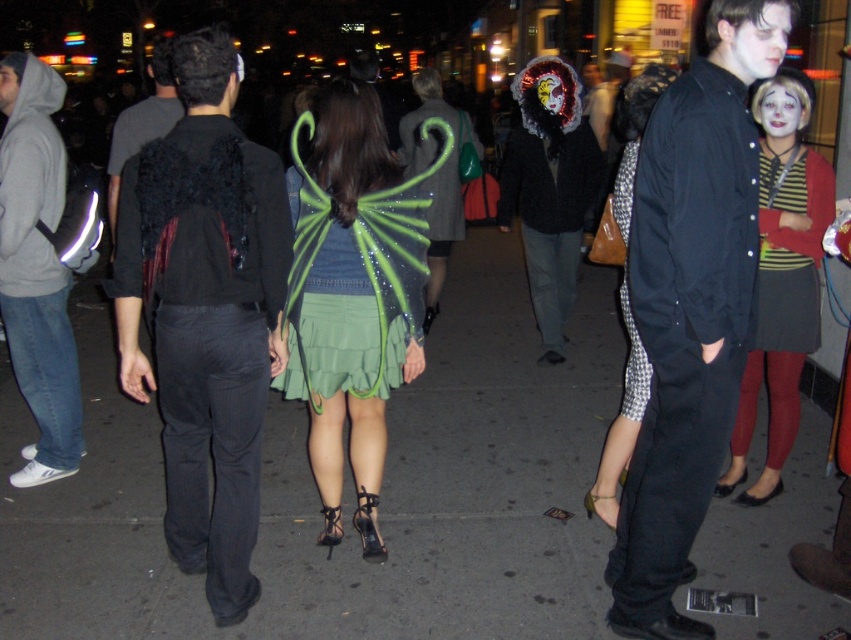
Question: Considering the relative positions of black pinstripe pants at center and striped knit dress at right in the image provided, where is black pinstripe pants at center located with respect to striped knit dress at right?

Choices:
 (A) above
 (B) below

Answer: (B)

Question: Among these points, which one is nearest to the camera?

Choices:
 (A) (43, 461)
 (B) (624, 243)
 (C) (435, 218)
 (D) (618, 433)

Answer: (D)

Question: Does black pinstripe pants at center have a lesser width compared to green fabric wings at center?

Choices:
 (A) no
 (B) yes

Answer: (A)

Question: Estimate the real-world distances between objects in this image. Which object is farther from the striped jersey at center?

Choices:
 (A) green fabric wings at center
 (B) white matte face at center

Answer: (A)

Question: Which point appears farthest from the camera in this image?

Choices:
 (A) (615, 216)
 (B) (391, 333)
 (C) (781, 120)
 (D) (758, 28)

Answer: (A)

Question: Does green sequined wings at center have a lesser width compared to striped jersey at center?

Choices:
 (A) no
 (B) yes

Answer: (A)